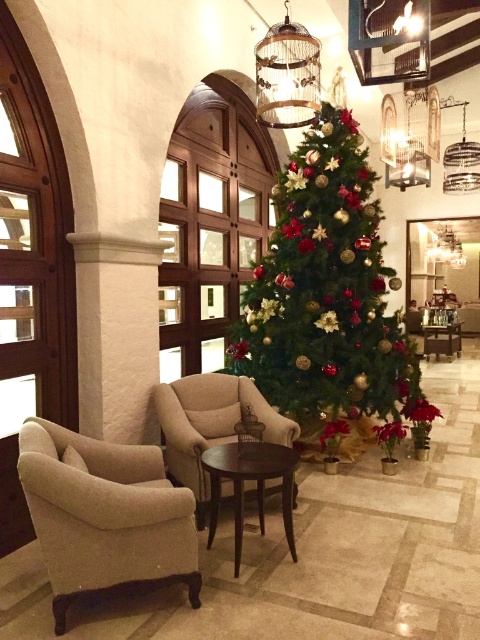
Can you confirm if shiny gold christmas tree at center is smaller than beige fabric armchair at center?

No, shiny gold christmas tree at center is not smaller than beige fabric armchair at center.

Which is in front, point (333, 253) or point (217, 420)?

Point (217, 420)

The width and height of the screenshot is (480, 640). What are the coordinates of `shiny gold christmas tree at center` in the screenshot? It's located at (325, 292).

Who is taller, shiny gold christmas tree at center or beige fabric armchair at left?

shiny gold christmas tree at center

Is shiny gold christmas tree at center shorter than beige fabric armchair at left?

No.

The image size is (480, 640). I want to click on shiny gold christmas tree at center, so click(x=325, y=292).

Identify the location of shiny gold christmas tree at center. This screenshot has height=640, width=480. (325, 292).

Does beige fabric armchair at left appear on the left side of beige fabric armchair at center?

Correct, you'll find beige fabric armchair at left to the left of beige fabric armchair at center.

Can you confirm if beige fabric armchair at left is positioned above beige fabric armchair at center?

Incorrect, beige fabric armchair at left is not positioned above beige fabric armchair at center.

The image size is (480, 640). What do you see at coordinates (104, 513) in the screenshot?
I see `beige fabric armchair at left` at bounding box center [104, 513].

Where is `beige fabric armchair at left`? This screenshot has width=480, height=640. beige fabric armchair at left is located at coordinates (104, 513).